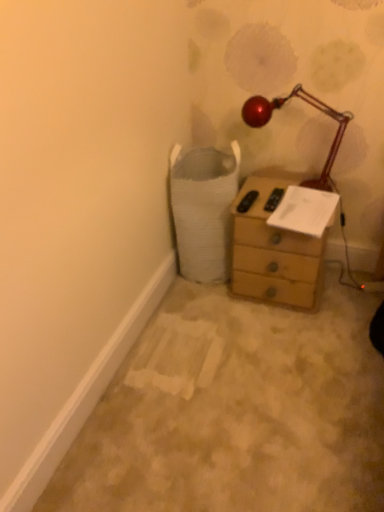
You are a GUI agent. You are given a task and a screenshot of the screen. Output one action in this format:
    pyautogui.click(x=<x>, y=<y>)
    Task: Click on the space that is in front of wooden chest of drawers at center
    This screenshot has height=512, width=384.
    Given the screenshot: What is the action you would take?
    pyautogui.click(x=288, y=339)